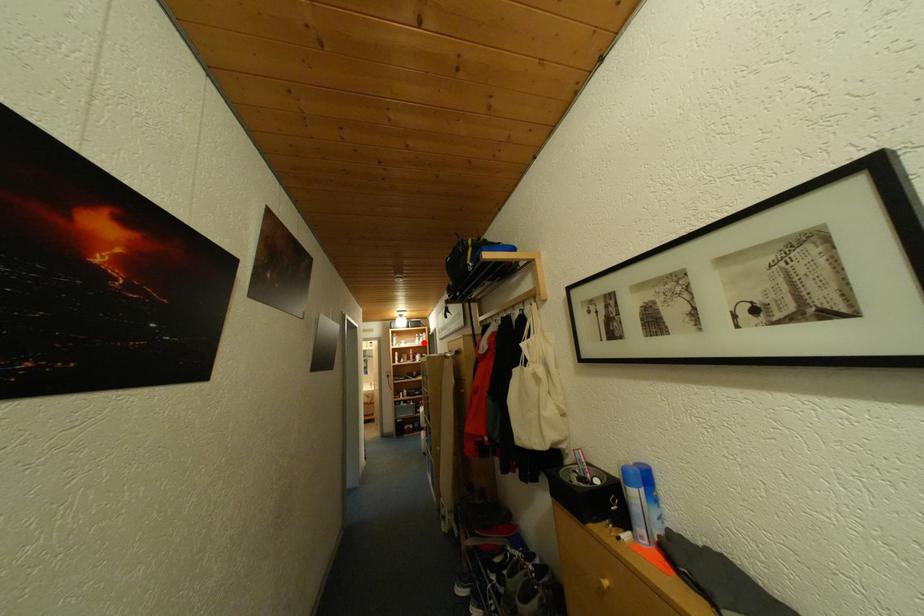
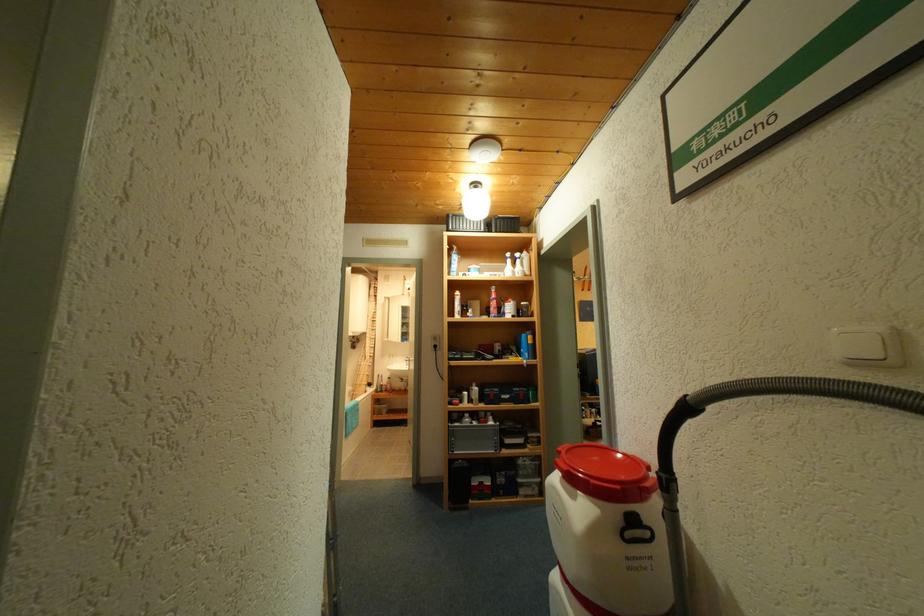
Where in the second image is the point corresponding to the highlighted location from the first image?

(512, 270)